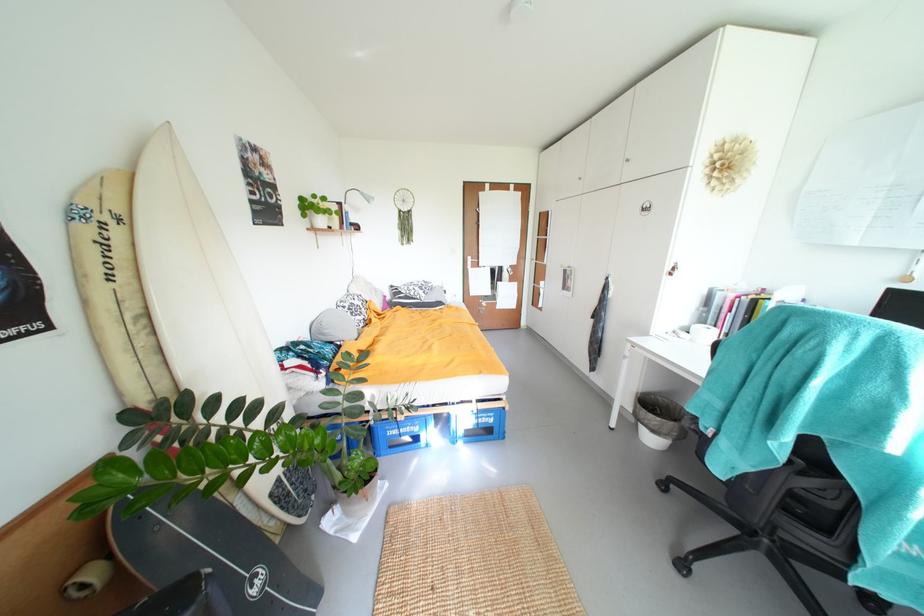
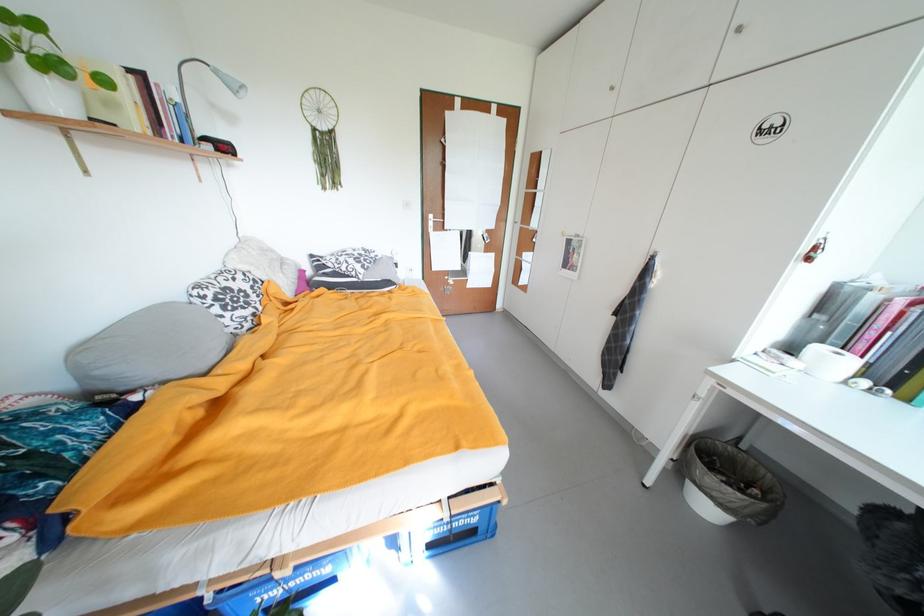
Question: I am providing you with two images of the same scene from different viewpoints. After the viewpoint changes to image2, which objects are now occluded?

Choices:
 (A) grey pillow
 (B) patterned pillow
 (C) blue plastic crate
 (D) none of these

Answer: (D)